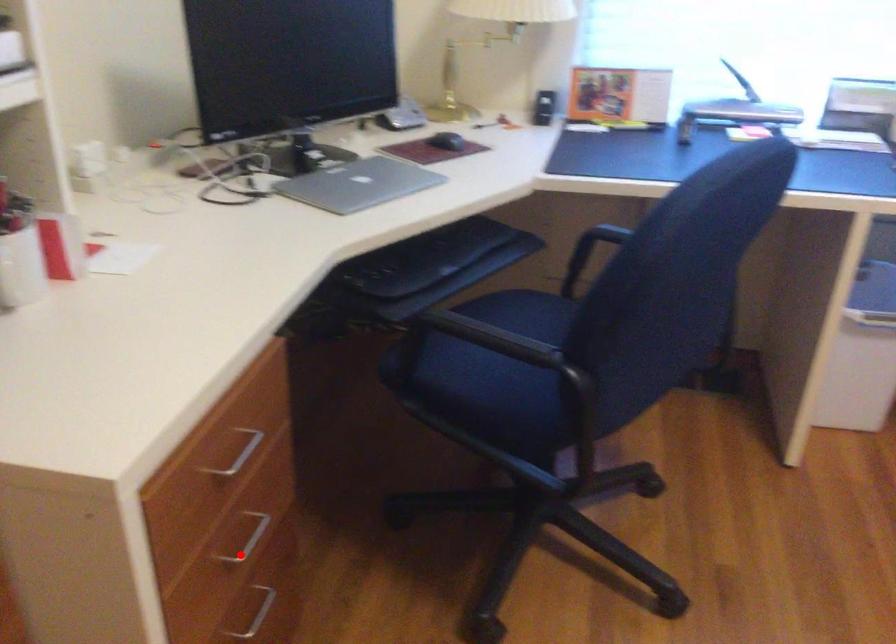
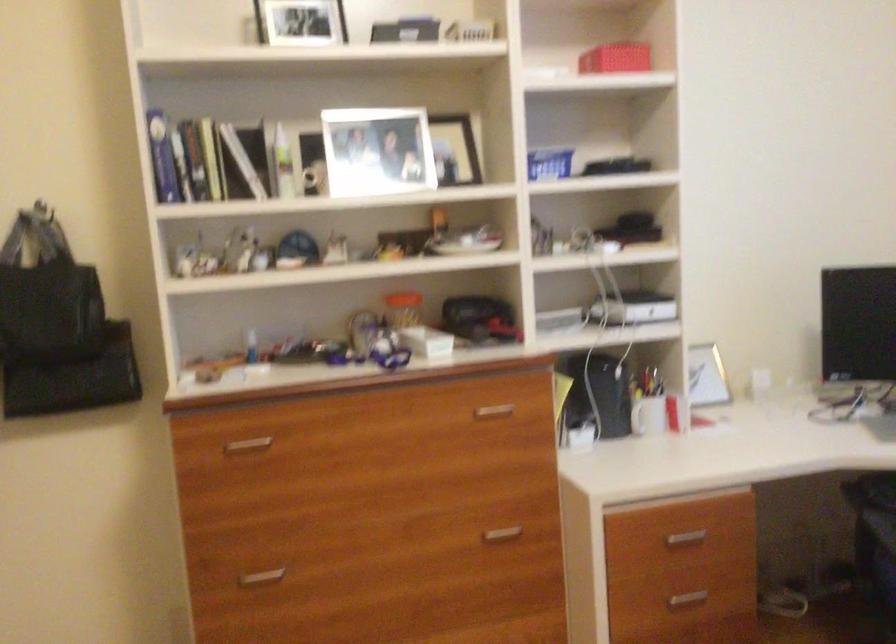
Question: I am providing you with two images of the same scene from different viewpoints. In image1, a red point is highlighted. Considering the same 3D point in image2, which of the following is correct?

Choices:
 (A) It is closer
 (B) It is farther

Answer: (B)